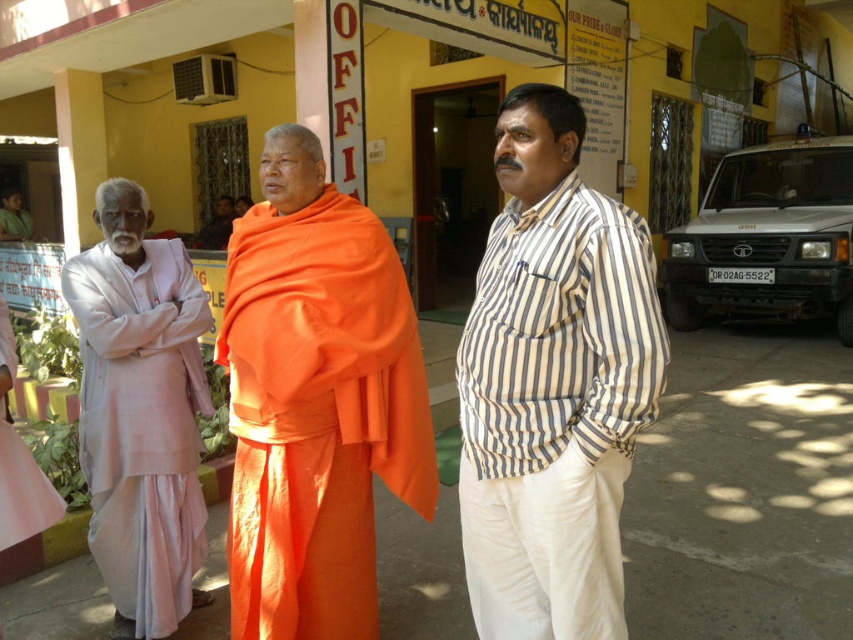
Question: Is striped cotton shirt at center to the right of light pink cotton kurta at left from the viewer's perspective?

Choices:
 (A) yes
 (B) no

Answer: (A)

Question: Estimate the real-world distances between objects in this image. Which object is farther from the light pink cotton kurta at left?

Choices:
 (A) striped cotton shirt at center
 (B) orange cloth at center

Answer: (A)

Question: Which object is farther from the camera taking this photo?

Choices:
 (A) striped cotton shirt at center
 (B) orange cloth at center
 (C) light pink cotton kurta at left

Answer: (C)

Question: Which of the following is the closest to the observer?

Choices:
 (A) (398, 300)
 (B) (160, 625)

Answer: (A)

Question: Is the position of striped cotton shirt at center more distant than that of light pink cotton kurta at left?

Choices:
 (A) yes
 (B) no

Answer: (B)

Question: Is orange cloth at center above light pink cotton kurta at left?

Choices:
 (A) yes
 (B) no

Answer: (A)